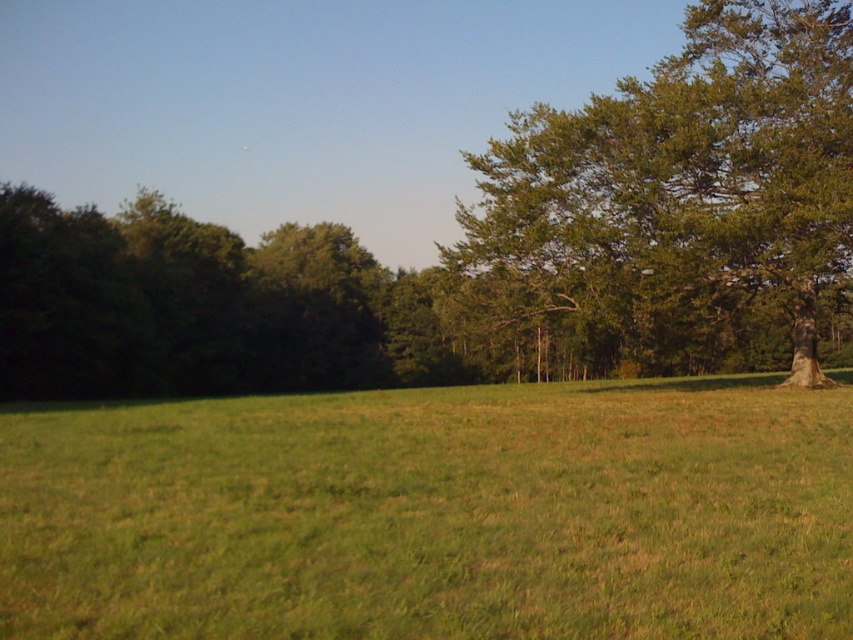
You are a gardener planning to plant a new flower bed in the green grass at center. Since you want the flowers to receive maximum sunlight, should you position the flower bed closer to the green leafy tree at right or away from it?

You should position the flower bed away from the green leafy tree at right because the green grass at center is located below the tree, meaning the tree would cast shade over the grass area beneath it, reducing sunlight exposure.

You are planning to set up a small tent for a picnic in the green grass at center. Considering the size of the green leafy tree at right, will the tree provide sufficient shade over the tent area?

The green grass at center is smaller than the green leafy tree at right, so the tree is larger and may provide sufficient shade over the tent area if positioned appropriately.

You are standing at the origin point of the image. Which direction should you move to reach the green grass at center?

The green grass at center is located at coordinate point 0.805 on the x axis and 0.510 on the y axis. Since you are at the origin point, you should move towards the right and slightly forward to reach it.